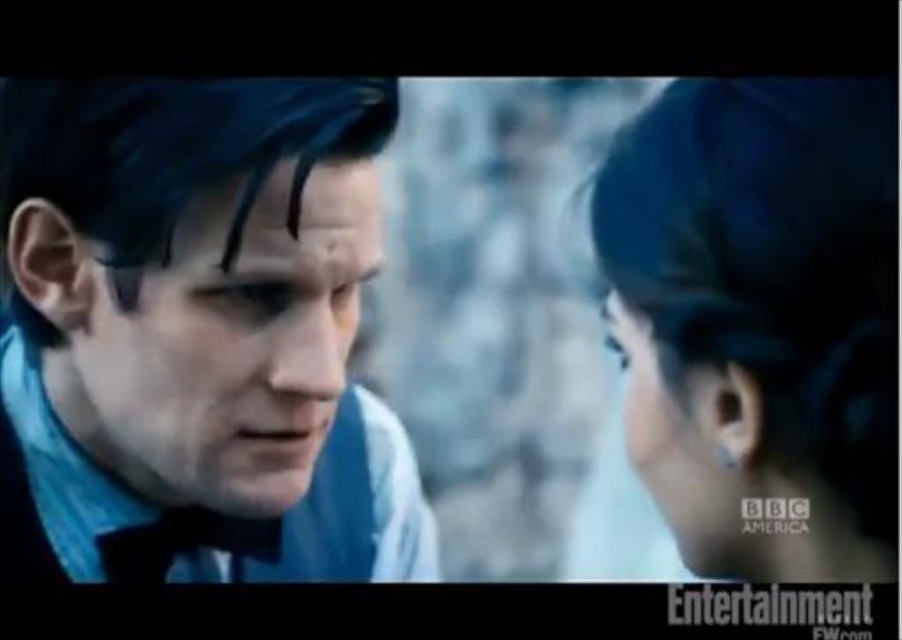
Which is above, blue hair at upper right or matte blue scarf at left?

Positioned higher is matte blue scarf at left.

Is blue hair at upper right above matte blue scarf at left?

No.

What do you see at coordinates (759, 321) in the screenshot?
I see `blue hair at upper right` at bounding box center [759, 321].

The image size is (902, 640). In order to click on blue hair at upper right in this screenshot , I will do `click(759, 321)`.

Based on the photo, does blue hair at upper right appear over black silky eyebrow at upper center?

No.

Which of these two, blue hair at upper right or black silky eyebrow at upper center, stands shorter?

black silky eyebrow at upper center

Does point (779, 560) come behind point (293, 196)?

No, it is in front of (293, 196).

Locate an element on the screen. The image size is (902, 640). blue hair at upper right is located at coordinates (759, 321).

Does blue velvet suit at left have a greater width compared to blue hair at upper right?

Indeed, blue velvet suit at left has a greater width compared to blue hair at upper right.

Between point (140, 486) and point (880, 310), which one is positioned in front?

Point (880, 310) is more forward.

Identify the location of blue velvet suit at left. This screenshot has width=902, height=640. (201, 330).